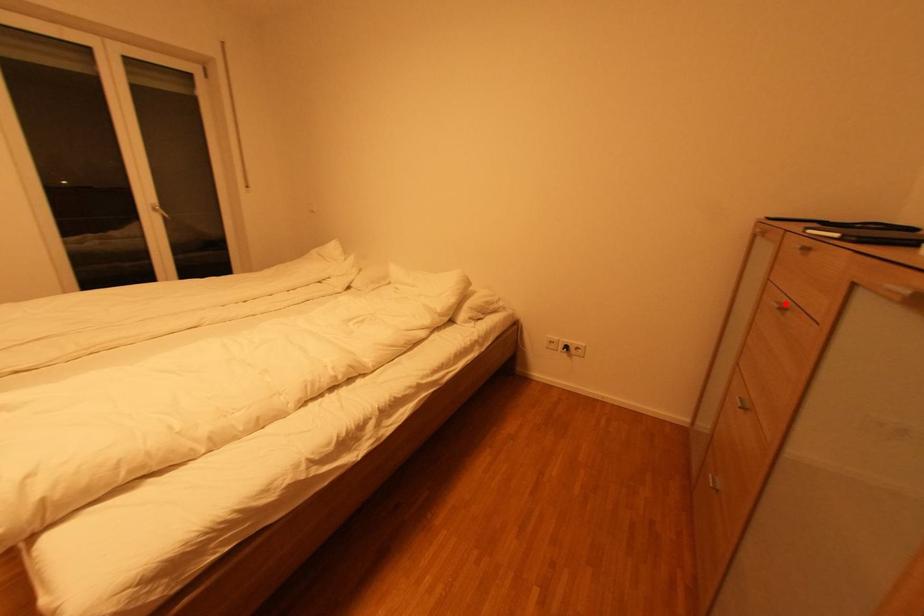
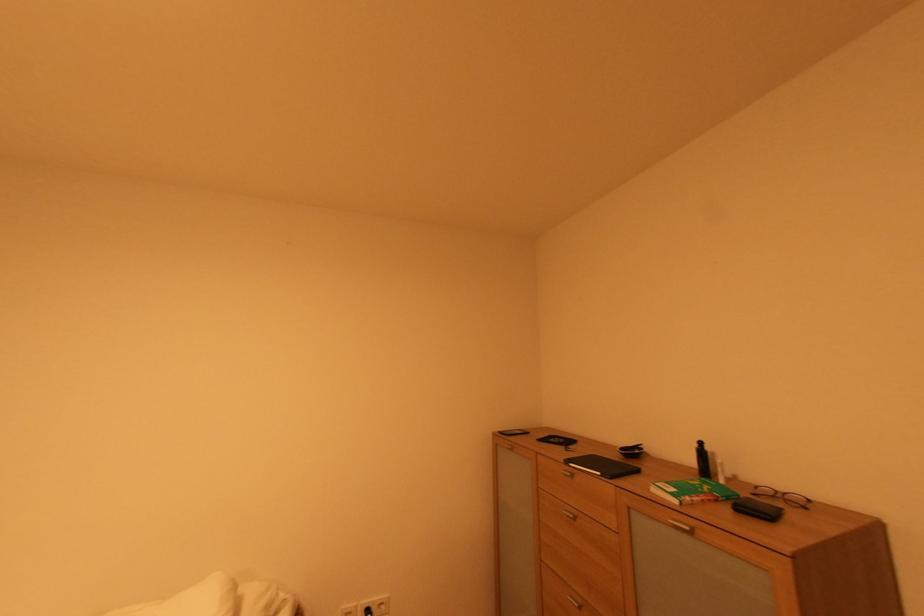
Find the pixel in the second image that matches the highlighted location in the first image.

(572, 512)